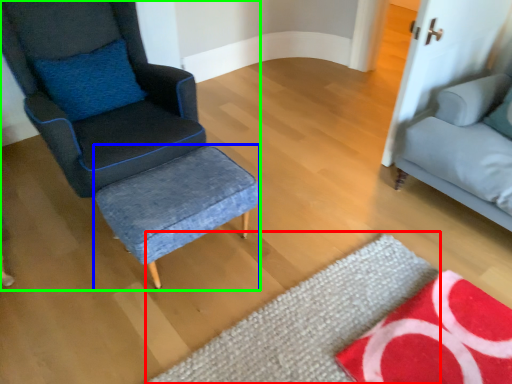
Question: Estimate the real-world distances between objects in this image. Which object is closer to mat (highlighted by a red box), stool (highlighted by a blue box) or chair (highlighted by a green box)?

Choices:
 (A) stool
 (B) chair

Answer: (A)